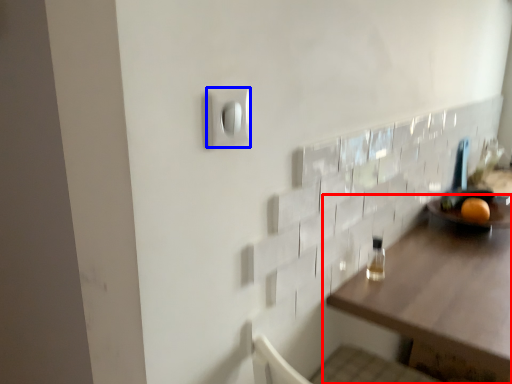
Question: Among these objects, which one is farthest to the camera, table (highlighted by a red box) or light switch (highlighted by a blue box)?

Choices:
 (A) table
 (B) light switch

Answer: (A)